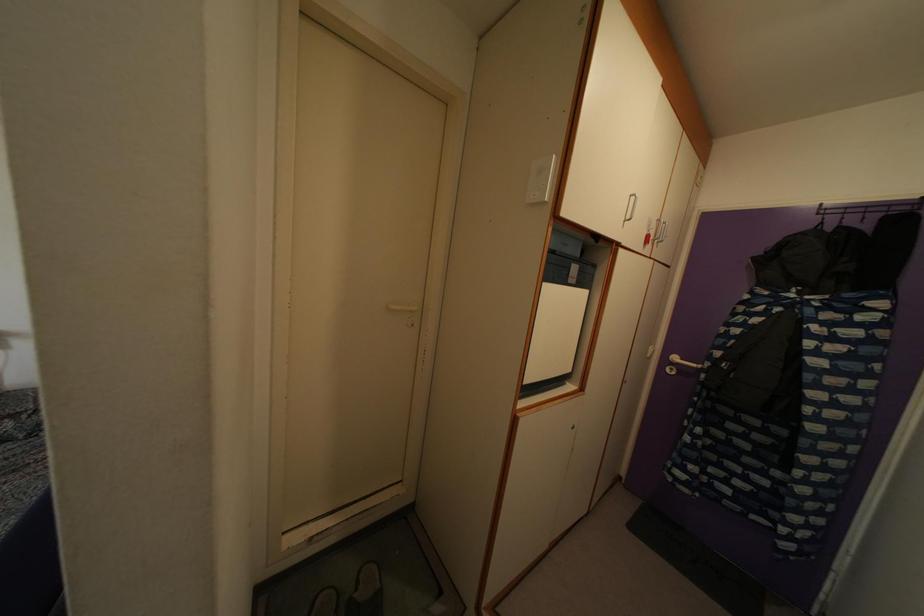
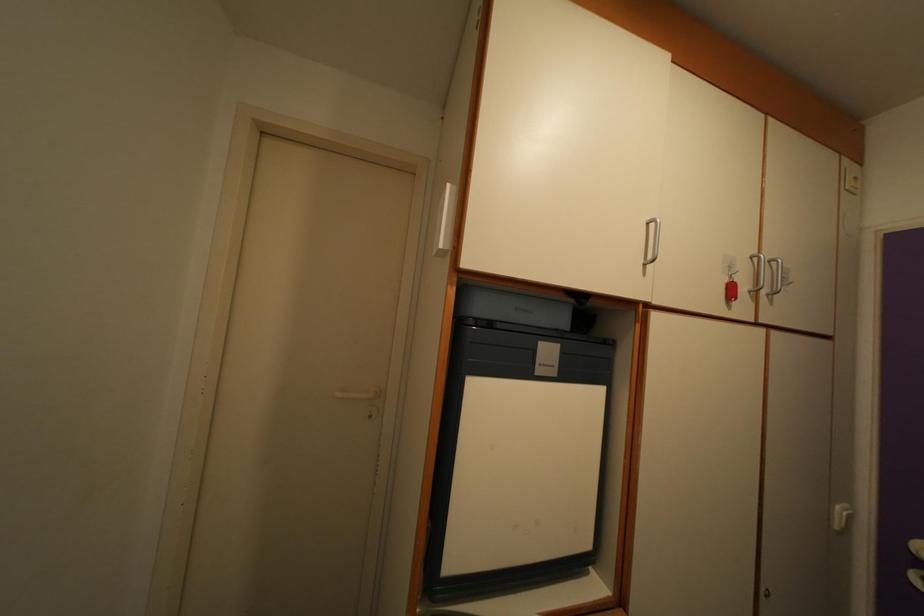
Find the pixel in the second image that matches (650,245) in the first image.

(735, 294)